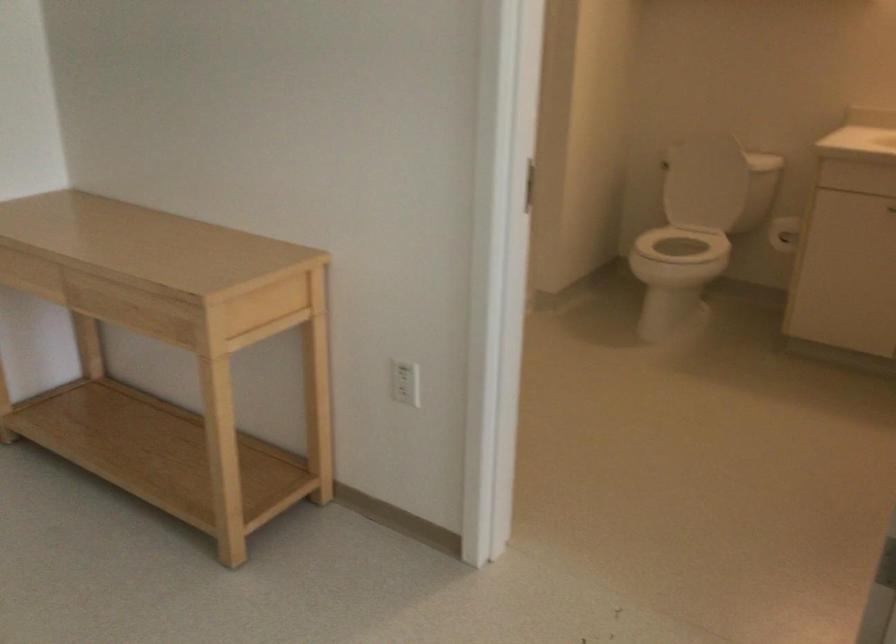
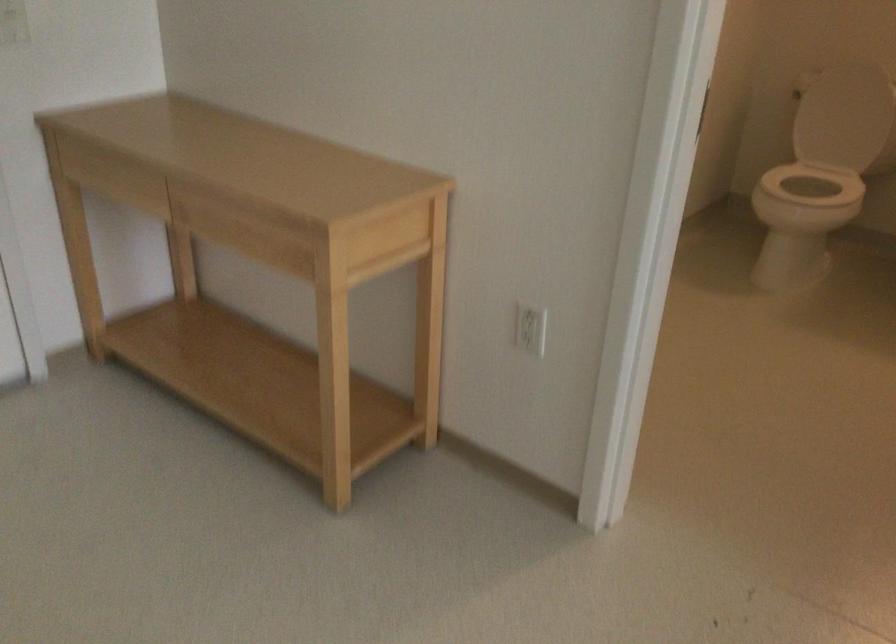
Where in the second image is the point corresponding to (x=691, y=187) from the first image?

(839, 118)